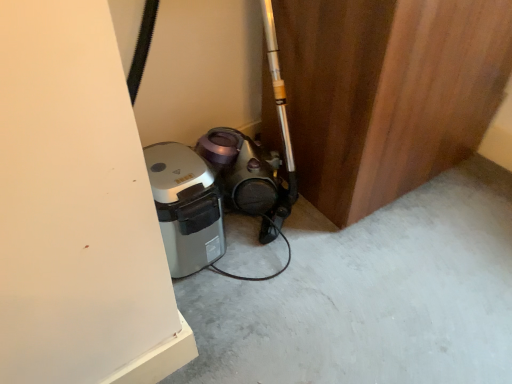
What do you see at coordinates (371, 295) in the screenshot?
I see `gray concrete at lower center` at bounding box center [371, 295].

What is the approximate height of gray concrete at lower center?

1.18 inches.

Identify the location of gray concrete at lower center. (371, 295).

Based on the photo, what is the approximate width of gray concrete at lower center?

The width of gray concrete at lower center is 1.61 meters.

Where is `gray concrete at lower center`? The image size is (512, 384). gray concrete at lower center is located at coordinates (371, 295).